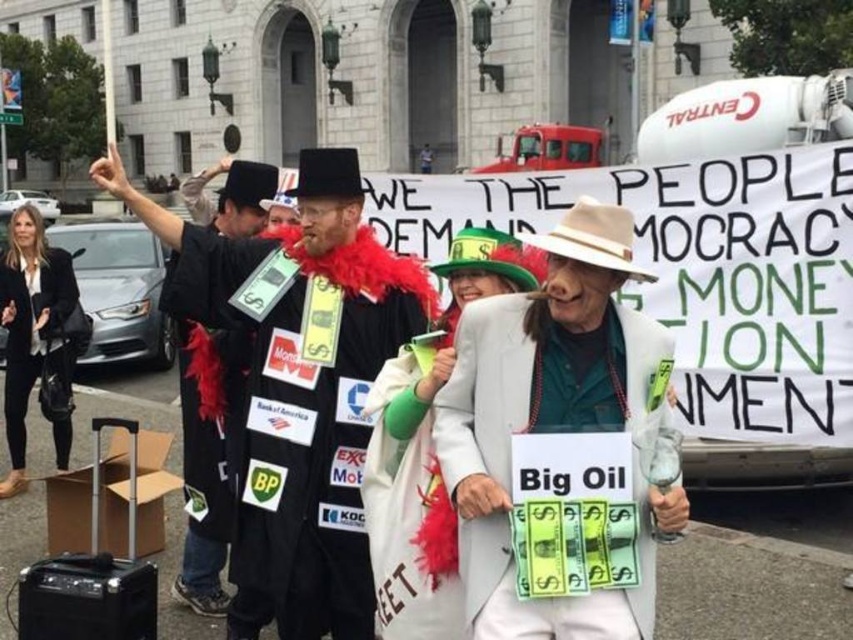
Can you confirm if white fabric coat at center is taller than black leather jacket at lower left?

Incorrect, white fabric coat at center's height is not larger of black leather jacket at lower left's.

Does white fabric coat at center appear over black leather jacket at lower left?

Actually, white fabric coat at center is below black leather jacket at lower left.

Where is `white fabric coat at center`? This screenshot has width=853, height=640. white fabric coat at center is located at coordinates (427, 451).

Where is `white fabric coat at center`? The width and height of the screenshot is (853, 640). white fabric coat at center is located at coordinates (427, 451).

Is black fabric coat at center to the left of white fabric suit at center from the viewer's perspective?

Correct, you'll find black fabric coat at center to the left of white fabric suit at center.

Image resolution: width=853 pixels, height=640 pixels. What do you see at coordinates (306, 401) in the screenshot?
I see `black fabric coat at center` at bounding box center [306, 401].

Locate an element on the screen. black fabric coat at center is located at coordinates (306, 401).

This screenshot has height=640, width=853. Find the location of `black fabric coat at center`. black fabric coat at center is located at coordinates (306, 401).

Is white fabric coat at center taller than black felt coat at center?

No.

Does white fabric coat at center come in front of black felt coat at center?

Yes, it is.

Does point (409, 532) come closer to viewer compared to point (206, 211)?

Yes, point (409, 532) is in front of point (206, 211).

The height and width of the screenshot is (640, 853). In order to click on white fabric coat at center in this screenshot , I will do `click(427, 451)`.